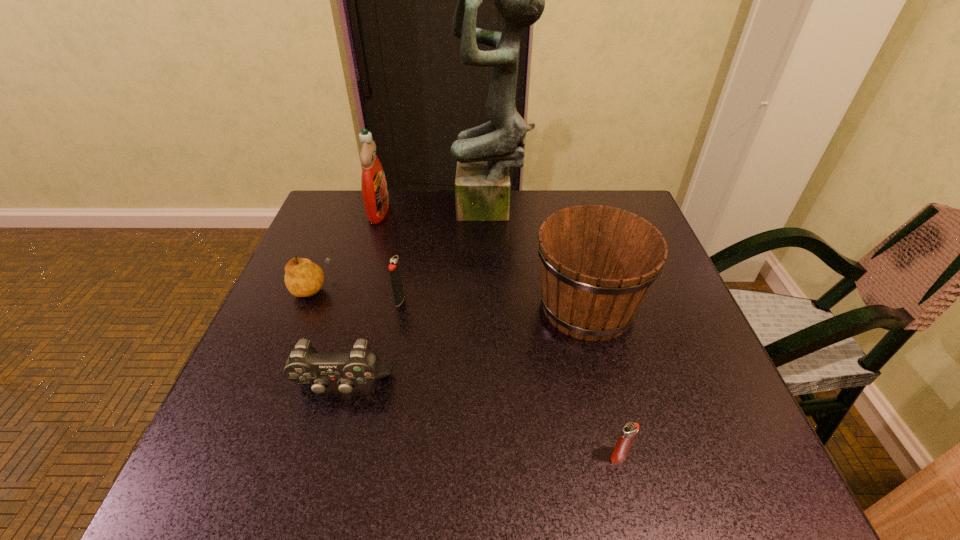
The width and height of the screenshot is (960, 540). What are the coordinates of `vacant space located 0.140m on the face of the tallest object` in the screenshot? It's located at (404, 211).

I want to click on free space located on the face of the tallest object, so click(429, 211).

Identify the location of vacant region located 0.250m on the front surface of the detergent. The width and height of the screenshot is (960, 540). (478, 212).

This screenshot has height=540, width=960. I want to click on vacant area located 0.200m on the front of the fifth shortest object, so click(x=622, y=448).

Where is `free region located 0.110m on the front of the left igniter`? This screenshot has width=960, height=540. free region located 0.110m on the front of the left igniter is located at coordinates (391, 346).

Find the location of a particular element. free space located 0.140m on the surface of the control with buttons is located at coordinates (315, 485).

Locate an element on the screen. Image resolution: width=960 pixels, height=540 pixels. vacant space situated 0.240m on the right of the pear is located at coordinates (434, 288).

I want to click on vacant area situated on the back of the nearer igniter, so click(x=581, y=295).

Where is `sculpture located in the far edge section of the desktop`? The width and height of the screenshot is (960, 540). sculpture located in the far edge section of the desktop is located at coordinates (484, 154).

At what (x,y) coordinates should I click in order to perform the action: click on detergent present at the far edge. Please return your answer as a coordinate pair (x, y). This screenshot has width=960, height=540. Looking at the image, I should click on (375, 196).